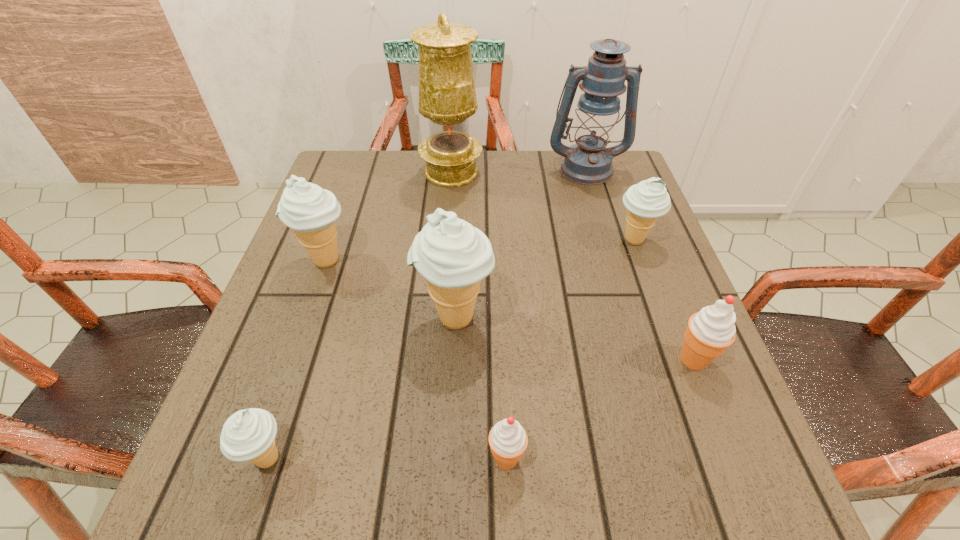
Where is `the left red icecream`? the left red icecream is located at coordinates (508, 440).

At what (x,y) coordinates should I click in order to perform the action: click on the smallest beige icecream. Please return your answer as a coordinate pair (x, y). Looking at the image, I should click on (249, 435).

You are a GUI agent. You are given a task and a screenshot of the screen. Output one action in this format:
    pyautogui.click(x=<x>, y=<y>)
    Task: Click on the free region located 0.300m on the right of the oil lamp
    This screenshot has height=540, width=960.
    Given the screenshot: What is the action you would take?
    pyautogui.click(x=593, y=172)

This screenshot has height=540, width=960. What are the coordinates of `vacant space situated on the front-facing side of the seventh shortest object` in the screenshot? It's located at [603, 224].

What are the coordinates of `blank space located on the right of the tallest icecream` in the screenshot? It's located at (x=613, y=318).

Identify the location of vacant space located 0.140m on the back of the fourth tallest object. The image size is (960, 540). 346,204.

Find the location of a particular element. This screenshot has height=540, width=960. free space located 0.370m on the left of the right red icecream is located at coordinates coord(464,359).

What are the coordinates of `vacant point located 0.390m on the left of the rightmost beige icecream` in the screenshot? It's located at (441, 240).

Identify the location of free spot located on the right of the smaller red icecream. Image resolution: width=960 pixels, height=540 pixels. (753, 458).

You are a GUI agent. You are given a task and a screenshot of the screen. Output one action in this format:
    pyautogui.click(x=<x>, y=<y>)
    Task: Click on the free region located 0.080m on the right of the smallest beige icecream
    The height and width of the screenshot is (540, 960).
    Given the screenshot: What is the action you would take?
    pyautogui.click(x=347, y=458)